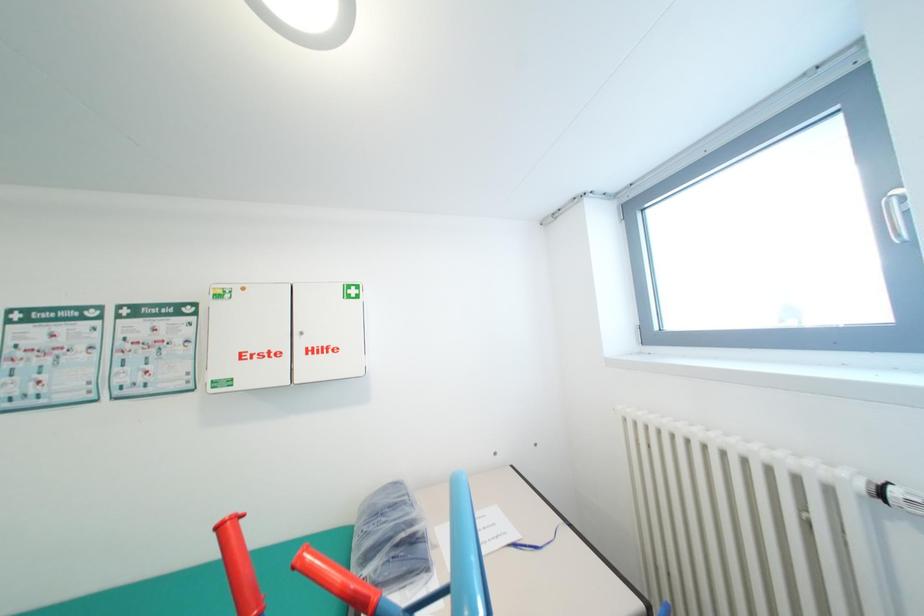
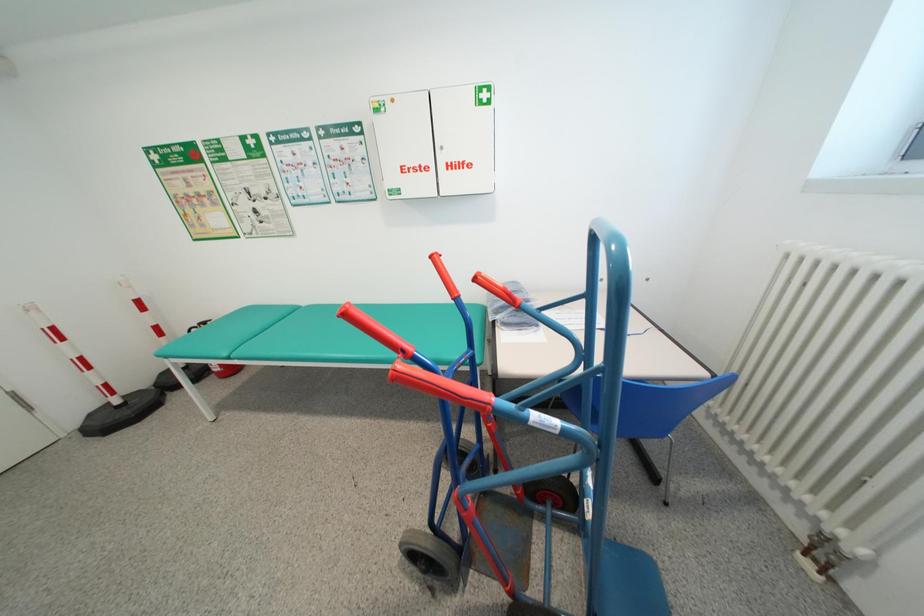
The first image is from the beginning of the video and the second image is from the end. How did the camera likely rotate when shooting the video?

The rotation direction of the camera is left-down.